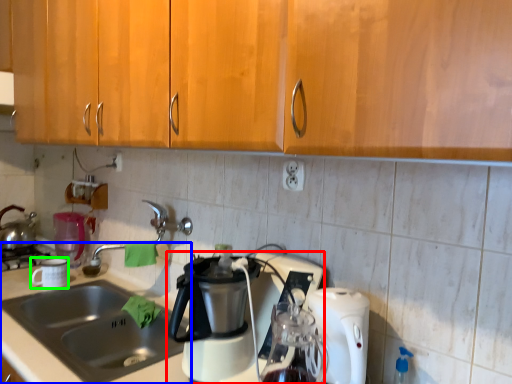
Question: Based on their relative distances, which object is nearer to coffee maker (highlighted by a red box)? Choose from sink (highlighted by a blue box) and coffee cup (highlighted by a green box).

Choices:
 (A) sink
 (B) coffee cup

Answer: (A)